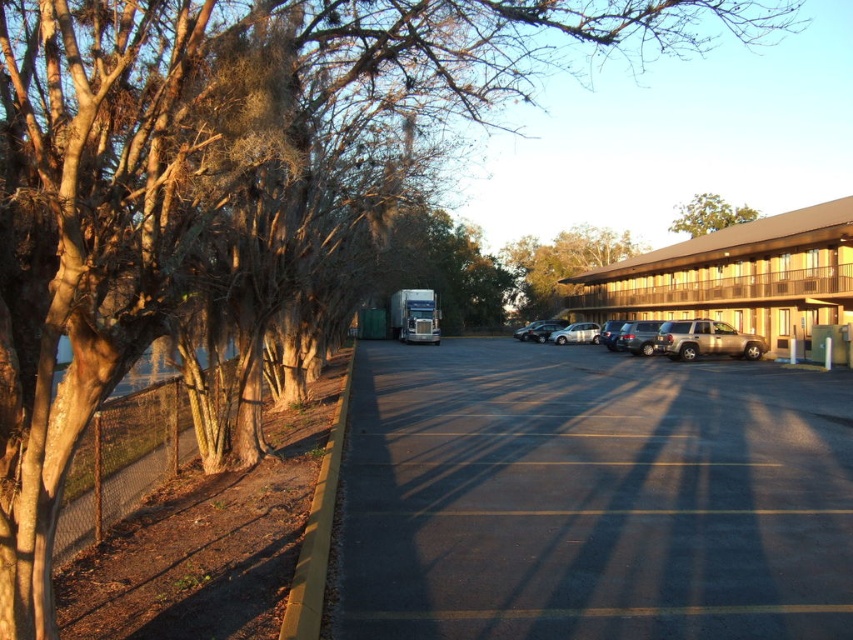
How distant is black asphalt parking lot at center from green textured tree at center?

black asphalt parking lot at center is 63.42 meters away from green textured tree at center.

Who is more distant from viewer, (850, 419) or (583, 225)?

The point (583, 225) is more distant.

Find the location of a particular element. The image size is (853, 640). black asphalt parking lot at center is located at coordinates (590, 497).

Can you confirm if beige wood motel at right is smaller than gold metallic suv at center-right?

Incorrect, beige wood motel at right is not smaller in size than gold metallic suv at center-right.

Does beige wood motel at right have a lesser width compared to gold metallic suv at center-right?

Incorrect, beige wood motel at right's width is not less than gold metallic suv at center-right's.

This screenshot has height=640, width=853. I want to click on beige wood motel at right, so click(735, 276).

Locate an element on the screen. This screenshot has height=640, width=853. beige wood motel at right is located at coordinates (735, 276).

Is green textured tree at center above gold metallic suv at center?

Yes, green textured tree at center is above gold metallic suv at center.

Is green textured tree at center positioned before gold metallic suv at center?

No, green textured tree at center is behind gold metallic suv at center.

Is point (531, 268) more distant than point (712, 353)?

Yes, it is behind point (712, 353).

Where is `green textured tree at center`? green textured tree at center is located at coordinates (560, 266).